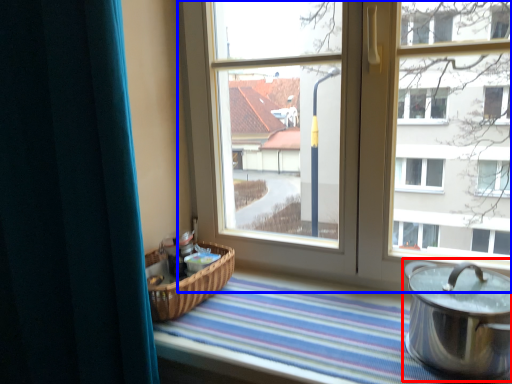
Question: Among these objects, which one is farthest to the camera, crock pot (highlighted by a red box) or window (highlighted by a blue box)?

Choices:
 (A) crock pot
 (B) window

Answer: (B)